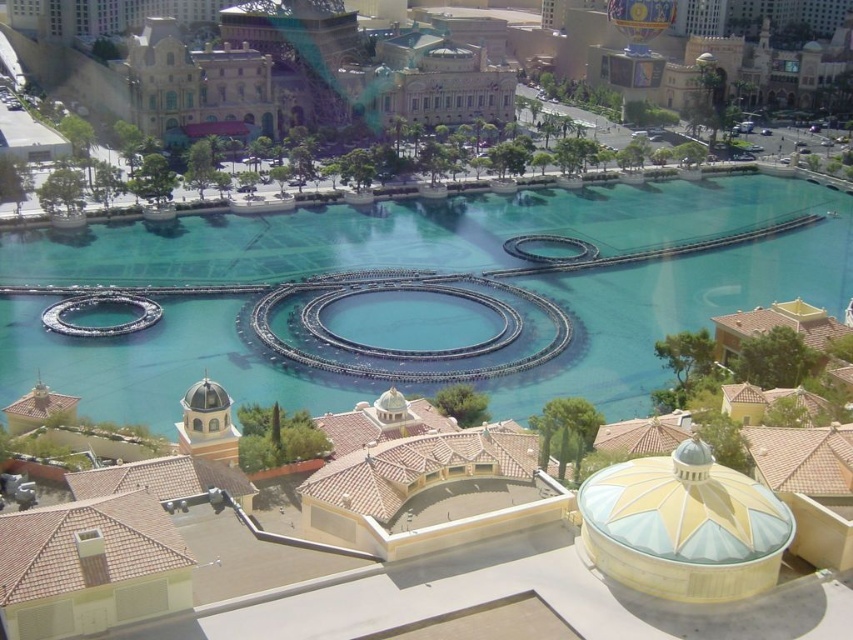
Question: Is clear blue water at center wider than beige stone building at upper center?

Choices:
 (A) yes
 (B) no

Answer: (A)

Question: Is clear blue water at center to the left of beige stone building at upper center from the viewer's perspective?

Choices:
 (A) no
 (B) yes

Answer: (A)

Question: Which point is closer to the camera taking this photo?

Choices:
 (A) (612, 397)
 (B) (457, 60)

Answer: (A)

Question: Does clear blue water at center appear under beige stone building at upper center?

Choices:
 (A) yes
 (B) no

Answer: (A)